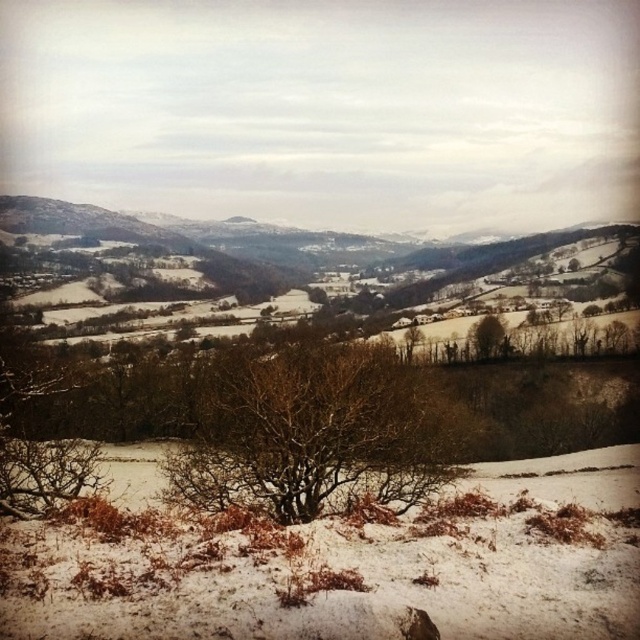
Between bare branches at center and brown textured tree at center, which one is positioned lower?

bare branches at center

Measure the distance between bare branches at center and camera.

48.87 feet

At what (x,y) coordinates should I click in order to perform the action: click on bare branches at center. Please return your answer as a coordinate pair (x, y). The height and width of the screenshot is (640, 640). Looking at the image, I should click on (314, 433).